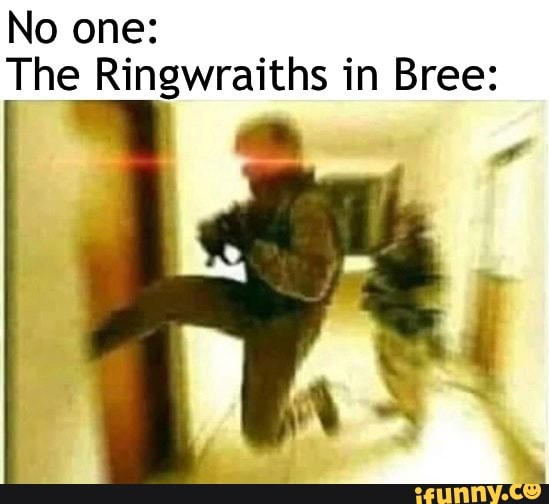
I want to click on window, so click(x=362, y=223).